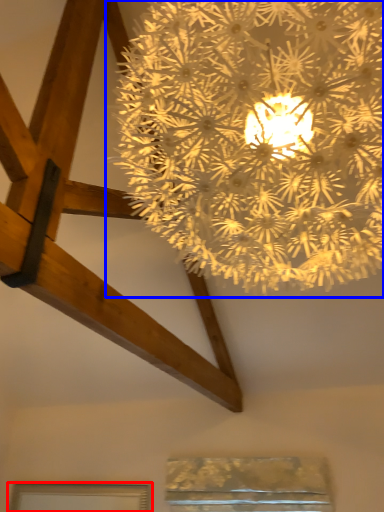
Question: Among these objects, which one is farthest to the camera, window (highlighted by a red box) or lamp (highlighted by a blue box)?

Choices:
 (A) window
 (B) lamp

Answer: (A)